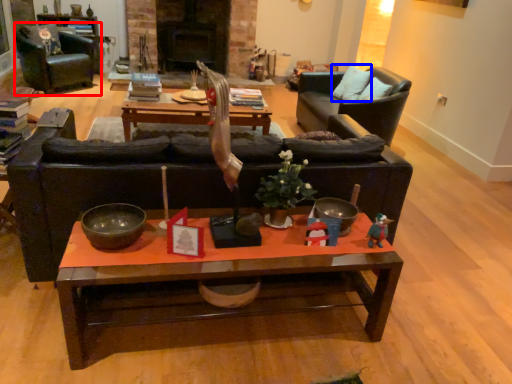
Question: Which point is further to the camera, chair (highlighted by a red box) or pillow (highlighted by a blue box)?

Choices:
 (A) chair
 (B) pillow

Answer: (A)